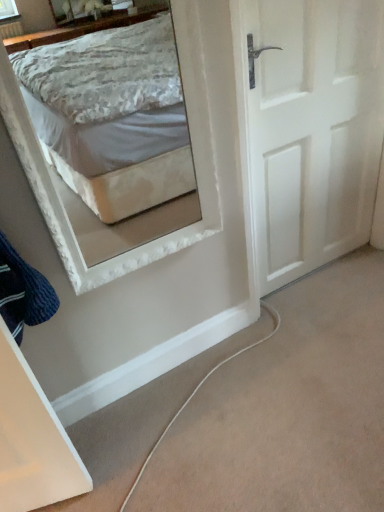
Question: Should I look upward or downward to see white matte door at right?

Choices:
 (A) down
 (B) up

Answer: (B)

Question: Is dark blue knitted sweater at lower left positioned beyond the bounds of white matte door at right?

Choices:
 (A) no
 (B) yes

Answer: (B)

Question: From a real-world perspective, is dark blue knitted sweater at lower left physically above white matte door at right?

Choices:
 (A) yes
 (B) no

Answer: (A)

Question: From a real-world perspective, is dark blue knitted sweater at lower left beneath white matte door at right?

Choices:
 (A) yes
 (B) no

Answer: (B)

Question: Can you confirm if dark blue knitted sweater at lower left is wider than white matte door at right?

Choices:
 (A) no
 (B) yes

Answer: (B)

Question: From the image's perspective, is dark blue knitted sweater at lower left over white matte door at right?

Choices:
 (A) no
 (B) yes

Answer: (A)

Question: Is dark blue knitted sweater at lower left bigger than white matte door at right?

Choices:
 (A) yes
 (B) no

Answer: (B)

Question: Is white matte door at right to the left of dark blue knitted sweater at lower left from the viewer's perspective?

Choices:
 (A) no
 (B) yes

Answer: (A)

Question: Are white matte door at right and dark blue knitted sweater at lower left making contact?

Choices:
 (A) yes
 (B) no

Answer: (B)

Question: Does white matte door at right appear on the right side of dark blue knitted sweater at lower left?

Choices:
 (A) yes
 (B) no

Answer: (A)

Question: Considering the relative positions of white matte door at right and dark blue knitted sweater at lower left in the image provided, is white matte door at right in front of dark blue knitted sweater at lower left?

Choices:
 (A) yes
 (B) no

Answer: (B)

Question: Considering the relative sizes of white matte door at right and dark blue knitted sweater at lower left in the image provided, is white matte door at right taller than dark blue knitted sweater at lower left?

Choices:
 (A) yes
 (B) no

Answer: (A)

Question: Is white matte door at right not close to dark blue knitted sweater at lower left?

Choices:
 (A) no
 (B) yes

Answer: (B)

Question: From the image's perspective, is dark blue knitted sweater at lower left above or below white matte door at right?

Choices:
 (A) above
 (B) below

Answer: (B)